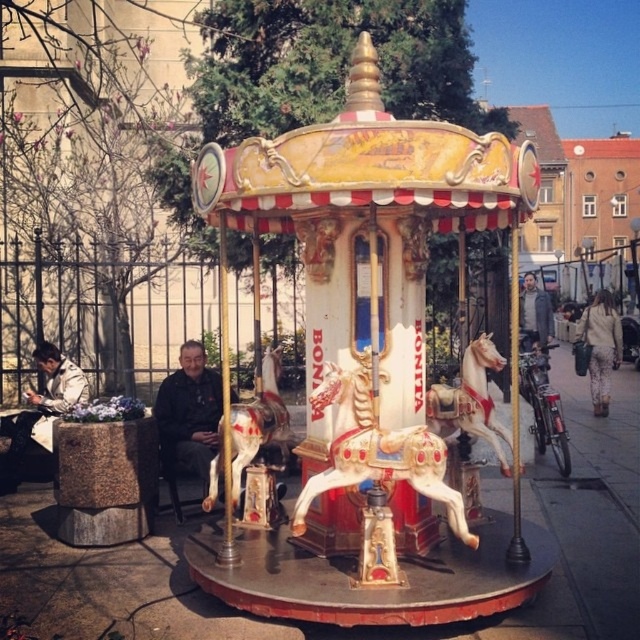
Does white glossy horse at center appear over white leather jacket at lower left?

Indeed, white glossy horse at center is positioned over white leather jacket at lower left.

Who is shorter, white glossy horse at center or white leather jacket at lower left?

white glossy horse at center

Where is `white glossy horse at center`? The image size is (640, 640). white glossy horse at center is located at coordinates (470, 401).

Is polished wood carousel at center positioned behind white glossy horse at center?

That is False.

Which is in front, point (442, 600) or point (436, 387)?

Point (442, 600) is more forward.

Is point (403, 360) positioned in front of point (467, 406)?

Yes, point (403, 360) is closer to viewer.

Find the location of a particular element. polished wood carousel at center is located at coordinates (369, 352).

Is white leather jacket at lower left below dark gray jacket at center?

Yes.

Which is below, white leather jacket at lower left or dark gray jacket at center?

white leather jacket at lower left is below.

Does point (58, 413) lie behind point (529, 332)?

That is False.

You are a GUI agent. You are given a task and a screenshot of the screen. Output one action in this format:
    pyautogui.click(x=<x>, y=<y>)
    Task: Click on the white leather jacket at lower left
    This screenshot has height=640, width=640.
    Given the screenshot: What is the action you would take?
    pyautogui.click(x=42, y=410)